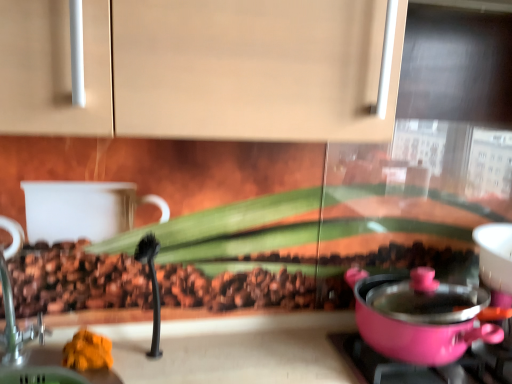
What do you see at coordinates (421, 317) in the screenshot?
I see `pink plastic pot at right` at bounding box center [421, 317].

What do you see at coordinates (16, 325) in the screenshot? This screenshot has width=512, height=384. I see `brushed metal faucet at left` at bounding box center [16, 325].

Where is `pink plastic pot at lower right`? This screenshot has width=512, height=384. pink plastic pot at lower right is located at coordinates (403, 365).

This screenshot has height=384, width=512. What do you see at coordinates (87, 351) in the screenshot?
I see `orange soft food at lower left` at bounding box center [87, 351].

Locate an element on the screen. pink plastic pot at right is located at coordinates (421, 317).

The height and width of the screenshot is (384, 512). I want to click on food that is behind the pink plastic pot at right, so click(87, 351).

From the image's perspective, which object appears higher, pink plastic pot at right or orange soft food at lower left?

pink plastic pot at right.

Looking at this image, how much distance is there between pink plastic pot at right and orange soft food at lower left?

They are 26.57 inches apart.

Are pink plastic pot at lower right and brushed metal faucet at left far apart?

That's not correct — pink plastic pot at lower right is a little close to brushed metal faucet at left.

Is point (353, 343) positioned behind point (36, 329)?

Yes, it is.

Who is shorter, pink plastic pot at lower right or brushed metal faucet at left?

With less height is pink plastic pot at lower right.

Is pink plastic pot at lower right oriented towards pink plastic pot at right?

No, pink plastic pot at lower right is not aimed at pink plastic pot at right.

Between pink plastic pot at lower right and pink plastic pot at right, which one has smaller width?

pink plastic pot at lower right.

What's the angular difference between pink plastic pot at lower right and pink plastic pot at right's facing directions?

The facing directions of pink plastic pot at lower right and pink plastic pot at right are 0.000308 degrees apart.

Who is shorter, pink plastic pot at lower right or pink plastic pot at right?

With less height is pink plastic pot at lower right.

Where is `kitchen appliance located in front of the pink plastic pot at lower right`? The image size is (512, 384). kitchen appliance located in front of the pink plastic pot at lower right is located at coordinates (421, 317).

Is pink plastic pot at right directly adjacent to pink plastic pot at lower right?

Yes, pink plastic pot at right is with pink plastic pot at lower right.

Could pink plastic pot at lower right be considered to be inside pink plastic pot at right?

No, pink plastic pot at lower right is located outside of pink plastic pot at right.

Which object is wider, pink plastic pot at right or pink plastic pot at lower right?

Wider between the two is pink plastic pot at right.

Which of these two, brushed metal faucet at left or pink plastic pot at right, stands taller?

brushed metal faucet at left is taller.

Can you tell me how much brushed metal faucet at left and pink plastic pot at right differ in facing direction?

The angular difference between brushed metal faucet at left and pink plastic pot at right is 0.00151 degrees.

Considering the sizes of brushed metal faucet at left and pink plastic pot at right in the image, is brushed metal faucet at left wider or thinner than pink plastic pot at right?

Clearly, brushed metal faucet at left has less width compared to pink plastic pot at right.

Looking at this image, are brushed metal faucet at left and pink plastic pot at right making contact?

No, brushed metal faucet at left is not with pink plastic pot at right.

From the image's perspective, between orange soft food at lower left and pink plastic pot at right, who is located below?

orange soft food at lower left, from the image's perspective.

Considering the positions of objects orange soft food at lower left and pink plastic pot at right in the image provided, who is behind, orange soft food at lower left or pink plastic pot at right?

Positioned behind is orange soft food at lower left.

Considering the sizes of objects orange soft food at lower left and pink plastic pot at right in the image provided, who is shorter, orange soft food at lower left or pink plastic pot at right?

orange soft food at lower left is shorter.

Is orange soft food at lower left thinner than pink plastic pot at right?

Correct, the width of orange soft food at lower left is less than that of pink plastic pot at right.

Looking at this image, from a real-world perspective, is brushed metal faucet at left located beneath orange soft food at lower left?

No.

Which object is wider, brushed metal faucet at left or orange soft food at lower left?

brushed metal faucet at left is wider.

From the image's perspective, which one is positioned lower, brushed metal faucet at left or orange soft food at lower left?

orange soft food at lower left appears lower in the image.

Can you tell me how much brushed metal faucet at left and orange soft food at lower left differ in facing direction?

There is a 0.00343-degree angle between the facing directions of brushed metal faucet at left and orange soft food at lower left.

Where is `kitchen appliance above the orange soft food at lower left (from a real-world perspective)`? This screenshot has height=384, width=512. kitchen appliance above the orange soft food at lower left (from a real-world perspective) is located at coordinates (421, 317).

The width and height of the screenshot is (512, 384). In the image, there is a brushed metal faucet at left. Identify the location of gas stove below it (from the image's perspective). (403, 365).

When comparing their distances from pink plastic pot at right, does orange soft food at lower left or pink plastic pot at lower right seem further?

orange soft food at lower left lies further to pink plastic pot at right than the other object.

Based on their spatial positions, is pink plastic pot at right or brushed metal faucet at left further from orange soft food at lower left?

pink plastic pot at right is positioned further to the anchor orange soft food at lower left.

Looking at this image, from the image, which object appears to be nearer to pink plastic pot at lower right, brushed metal faucet at left or orange soft food at lower left?

The object closer to pink plastic pot at lower right is orange soft food at lower left.

From the image, which object appears to be farther from brushed metal faucet at left, pink plastic pot at right or pink plastic pot at lower right?

pink plastic pot at right lies further to brushed metal faucet at left than the other object.

Estimate the real-world distances between objects in this image. Which object is further from orange soft food at lower left, pink plastic pot at lower right or pink plastic pot at right?

pink plastic pot at right lies further to orange soft food at lower left than the other object.

From the image, which object appears to be nearer to pink plastic pot at lower right, pink plastic pot at right or orange soft food at lower left?

pink plastic pot at right.

From the image, which object appears to be nearer to pink plastic pot at right, brushed metal faucet at left or pink plastic pot at lower right?

The object closer to pink plastic pot at right is pink plastic pot at lower right.

Which object lies nearer to the anchor point brushed metal faucet at left, orange soft food at lower left or pink plastic pot at right?

Among the two, orange soft food at lower left is located nearer to brushed metal faucet at left.

The height and width of the screenshot is (384, 512). In order to click on food between brushed metal faucet at left and pink plastic pot at lower right from left to right in this screenshot , I will do `click(87, 351)`.

Locate an element on the screen. kitchen appliance located between orange soft food at lower left and pink plastic pot at lower right in the left-right direction is located at coordinates (421, 317).

At what (x,y) coordinates should I click in order to perform the action: click on food between brushed metal faucet at left and pink plastic pot at right from left to right. Please return your answer as a coordinate pair (x, y). Image resolution: width=512 pixels, height=384 pixels. Looking at the image, I should click on pyautogui.click(x=87, y=351).

Image resolution: width=512 pixels, height=384 pixels. Find the location of `kitchen appliance between brushed metal faucet at left and pink plastic pot at lower right in the horizontal direction`. kitchen appliance between brushed metal faucet at left and pink plastic pot at lower right in the horizontal direction is located at coordinates (421, 317).